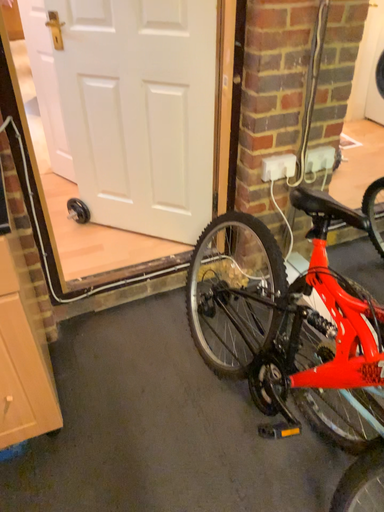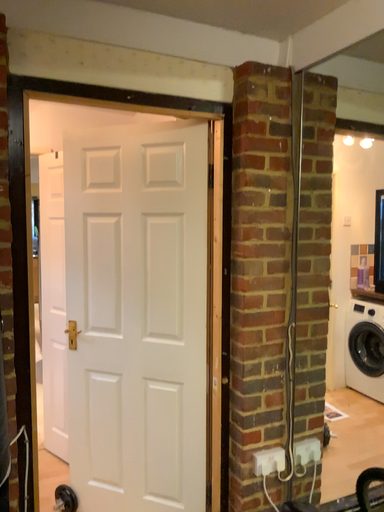
Question: Which way did the camera rotate in the video?

Choices:
 (A) rotated downward
 (B) rotated upward

Answer: (B)